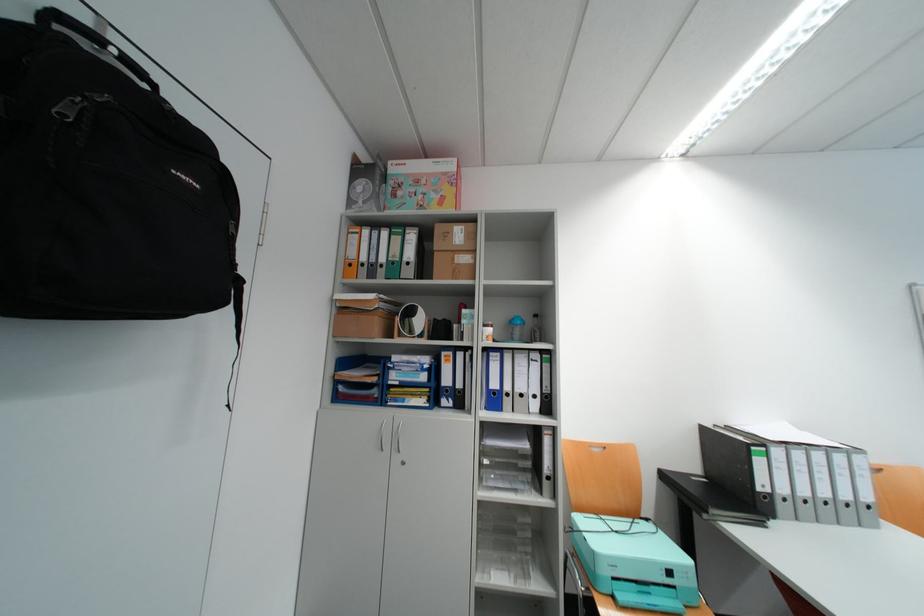
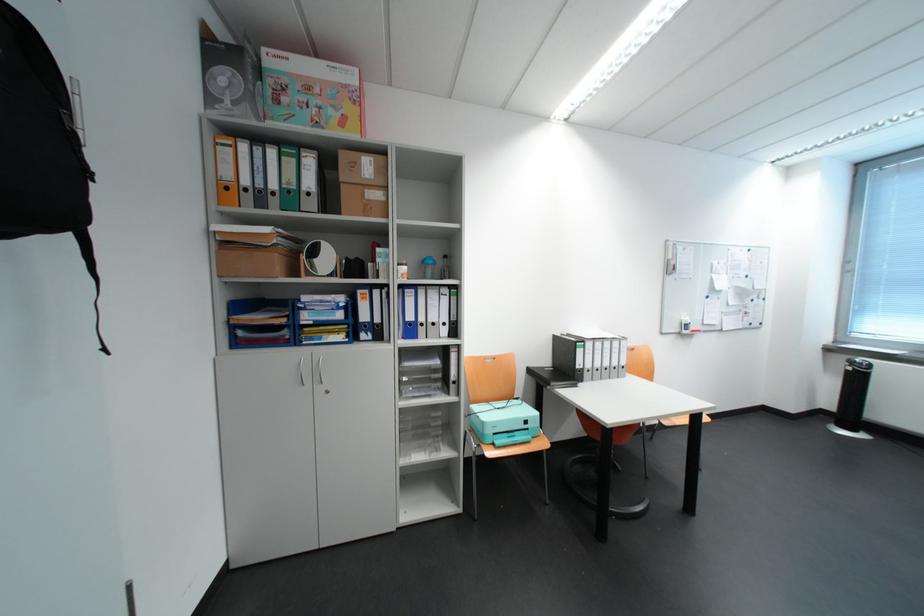
Find the pixel in the second image that matches point 397,169 in the first image.

(272, 60)